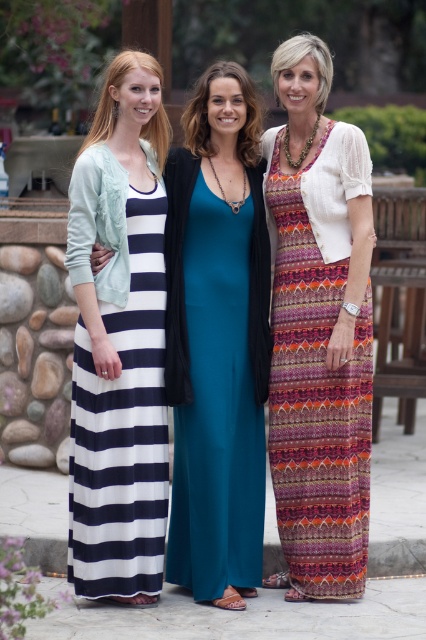
Is patterned knit dress at center to the left of teal satin dress at center from the viewer's perspective?

Indeed, patterned knit dress at center is positioned on the left side of teal satin dress at center.

Who is taller, patterned knit dress at center or teal satin dress at center?

patterned knit dress at center is taller.

Is point (239, 513) closer to camera compared to point (196, 419)?

That is False.

This screenshot has width=426, height=640. I want to click on patterned knit dress at center, so click(x=218, y=340).

Find the location of a particular element. The image size is (426, 640). teal satin dress at center is located at coordinates (215, 378).

Does teal satin dress at center have a smaller size compared to multicolored woven dress at right?

Indeed, teal satin dress at center has a smaller size compared to multicolored woven dress at right.

Image resolution: width=426 pixels, height=640 pixels. What are the coordinates of `teal satin dress at center` in the screenshot? It's located at (215, 378).

Which is behind, point (210, 301) or point (109, 292)?

The point (210, 301) is behind.

Is teal satin dress at center further to the viewer compared to navy/white striped dress at left?

That is True.

Where is `teal satin dress at center`? This screenshot has height=640, width=426. teal satin dress at center is located at coordinates (x=215, y=378).

The width and height of the screenshot is (426, 640). Identify the location of teal satin dress at center. (215, 378).